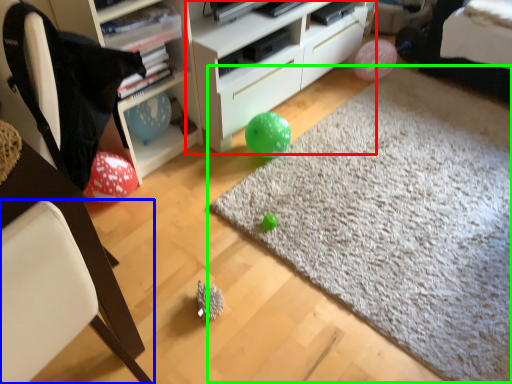
Question: Based on their relative distances, which object is nearer to cabinetry (highlighted by a red box)? Choose from chair (highlighted by a blue box) and plain (highlighted by a green box).

Choices:
 (A) chair
 (B) plain

Answer: (B)